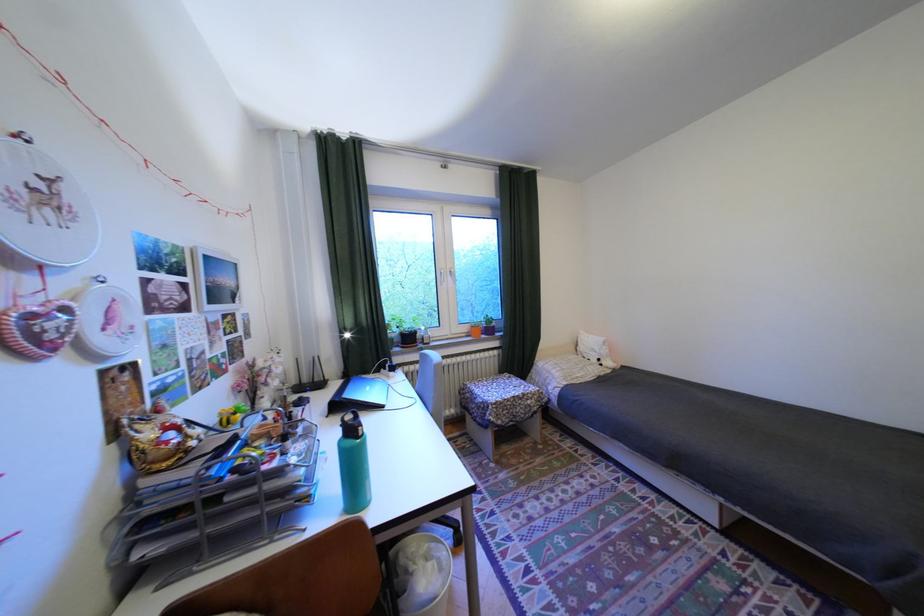
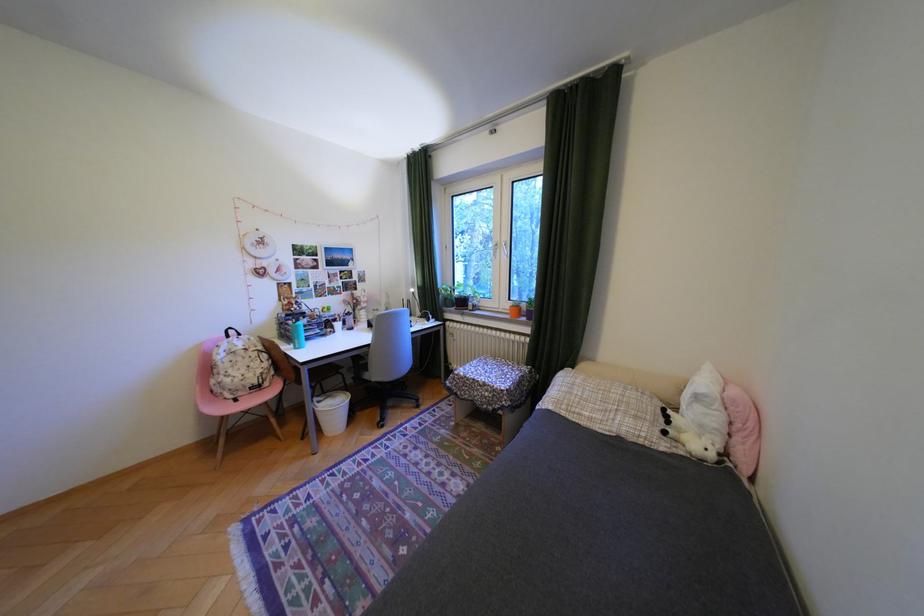
Locate, in the second image, the point that corresponds to point (421, 339) in the first image.

(475, 302)